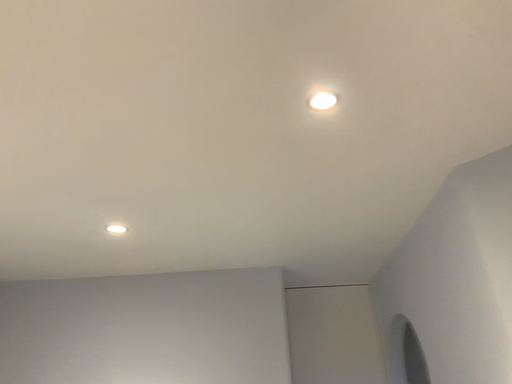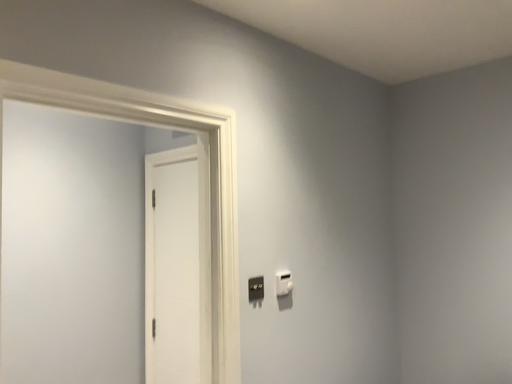
Question: Which way did the camera rotate in the video?

Choices:
 (A) rotated left
 (B) rotated right

Answer: (A)